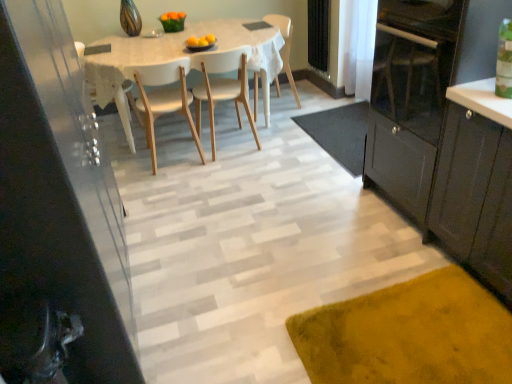
What is the approximate height of velvety yellow rug at lower right, positioned as the second doormat in back-to-front order?

velvety yellow rug at lower right, positioned as the second doormat in back-to-front order, is 1.71 inches in height.

This screenshot has height=384, width=512. Describe the element at coordinates (340, 133) in the screenshot. I see `black rubber doormat at center, which appears as the second doormat when ordered from the bottom` at that location.

The height and width of the screenshot is (384, 512). Describe the element at coordinates (162, 98) in the screenshot. I see `white matte chair at center, placed as the first chair when sorted from left to right` at that location.

Describe the element at coordinates (182, 56) in the screenshot. I see `white wood table at center` at that location.

This screenshot has width=512, height=384. I want to click on matte black cabinet at left, marked as the second cabinetry in a right-to-left arrangement, so click(56, 215).

Which object is further away from the camera, white wood table at center or white matte chair at center, which is the third chair in right-to-left order?

white wood table at center is more distant.

Considering the relative sizes of white wood table at center and white matte chair at center, placed as the first chair when sorted from left to right, in the image provided, is white wood table at center taller than white matte chair at center, placed as the first chair when sorted from left to right,?

In fact, white wood table at center may be shorter than white matte chair at center, placed as the first chair when sorted from left to right.

Which of these two, white wood table at center or white matte chair at center, placed as the first chair when sorted from left to right, is bigger?

With larger size is white wood table at center.

Does point (39, 135) lie in front of point (85, 69)?

Yes, it is.

Which of these two, matte black cabinet at left, which is the first cabinetry in left-to-right order, or white wood table at center, is bigger?

With larger size is white wood table at center.

Is matte black cabinet at left, which is the first cabinetry in left-to-right order, touching white wood table at center?

No.

Does matte black cabinet at left, which is the first cabinetry in left-to-right order, contain white wood table at center?

No, white wood table at center is not a part of matte black cabinet at left, which is the first cabinetry in left-to-right order.

Which object is wider, white sheer curtain at upper right or white matte chair at center, which is the third chair in right-to-left order?

white matte chair at center, which is the third chair in right-to-left order, is wider.

Does white sheer curtain at upper right touch white matte chair at center, placed as the first chair when sorted from left to right?

No, white sheer curtain at upper right is not next to white matte chair at center, placed as the first chair when sorted from left to right.

Between white sheer curtain at upper right and white matte chair at center, placed as the first chair when sorted from left to right, which one appears on the left side from the viewer's perspective?

Positioned to the left is white matte chair at center, placed as the first chair when sorted from left to right.

From the white sheer curtain at upper right, count the 3rd chair to the left and point to it. Please provide its 2D coordinates.

[(162, 98)]

Would you say white matte chair at center, placed as the first chair when sorted from left to right, is outside dark gray wood cabinet at right, which ranks as the second cabinetry in left-to-right order?

Yes, white matte chair at center, placed as the first chair when sorted from left to right, is located beyond the bounds of dark gray wood cabinet at right, which ranks as the second cabinetry in left-to-right order.

Based on their sizes in the image, would you say white matte chair at center, placed as the first chair when sorted from left to right, is bigger or smaller than dark gray wood cabinet at right, the 1th cabinetry positioned from the right?

Clearly, white matte chair at center, placed as the first chair when sorted from left to right, is smaller in size than dark gray wood cabinet at right, the 1th cabinetry positioned from the right.

Considering the points (151, 115) and (496, 247), which point is in front, point (151, 115) or point (496, 247)?

The point (496, 247) is more forward.

From the image's perspective, starting from the dark gray wood cabinet at right, which ranks as the second cabinetry in left-to-right order, which chair is the 1st one above? Please provide its 2D coordinates.

[(162, 98)]

Is matte black cabinet at left, which is the first cabinetry in left-to-right order, positioned with its back to black rubber doormat at center, acting as the 1th doormat starting from the top?

No, matte black cabinet at left, which is the first cabinetry in left-to-right order,'s orientation is not away from black rubber doormat at center, acting as the 1th doormat starting from the top.

Is the depth of matte black cabinet at left, which is the first cabinetry in left-to-right order, greater than that of black rubber doormat at center, marked as the first doormat in a back-to-front arrangement?

No, it is not.

Is matte black cabinet at left, marked as the second cabinetry in a right-to-left arrangement, to the left or to the right of black rubber doormat at center, which is the 2th doormat in front-to-back order, in the image?

matte black cabinet at left, marked as the second cabinetry in a right-to-left arrangement, is to the left of black rubber doormat at center, which is the 2th doormat in front-to-back order.

What are the coordinates of `the 2nd doormat below the matte black cabinet at left, which is the first cabinetry in left-to-right order (from a real-world perspective)` in the screenshot? It's located at (340, 133).

Which object is wider, matte black cabinet at left, which is the first cabinetry in left-to-right order, or natural wood chair at center, which is counted as the 2th chair, starting from the right?

matte black cabinet at left, which is the first cabinetry in left-to-right order.

Which is more to the right, matte black cabinet at left, marked as the second cabinetry in a right-to-left arrangement, or natural wood chair at center, which is counted as the 2th chair, starting from the right?

From the viewer's perspective, natural wood chair at center, which is counted as the 2th chair, starting from the right, appears more on the right side.

From a real-world perspective, which chair is the 1st one underneath the matte black cabinet at left, marked as the second cabinetry in a right-to-left arrangement? Please provide its 2D coordinates.

[(222, 87)]

Between matte black cabinet at left, which is the first cabinetry in left-to-right order, and natural wood chair at center, the second chair in the left-to-right sequence, which one has larger size?

matte black cabinet at left, which is the first cabinetry in left-to-right order, is bigger.

Is white sheer curtain at upper right to the left of white wood table at center from the viewer's perspective?

Incorrect, white sheer curtain at upper right is not on the left side of white wood table at center.

Is white sheer curtain at upper right facing towards white wood table at center?

Yes, white sheer curtain at upper right is facing white wood table at center.

Looking at their sizes, would you say white sheer curtain at upper right is wider or thinner than white wood table at center?

Considering their sizes, white sheer curtain at upper right looks slimmer than white wood table at center.

Image resolution: width=512 pixels, height=384 pixels. In order to click on kitchen & dining room table that is on the left side of white sheer curtain at upper right in this screenshot , I will do `click(182, 56)`.

Identify the location of kitchen & dining room table behind the white matte chair at center, placed as the first chair when sorted from left to right. The height and width of the screenshot is (384, 512). (182, 56).

Which cabinetry is the 2nd one when counting from the front of the white wood table at center? Please provide its 2D coordinates.

[(56, 215)]

When comparing their distances from white wood table at center, does velvety yellow rug at lower right, positioned as the second doormat in back-to-front order, or dark gray wood cabinet at right, the 1th cabinetry positioned from the right, seem further?

Among the two, velvety yellow rug at lower right, positioned as the second doormat in back-to-front order, is located further to white wood table at center.

Estimate the real-world distances between objects in this image. Which object is further from white sheer curtain at upper right, matte black cabinet at left, which is the first cabinetry in left-to-right order, or dark gray wood cabinet at right, which ranks as the second cabinetry in left-to-right order?

matte black cabinet at left, which is the first cabinetry in left-to-right order.

When comparing their distances from white matte chair at center, which is the third chair in right-to-left order, does white wood chair at center, positioned as the first chair in right-to-left order, or velvety yellow rug at lower right, which ranks as the 1th doormat in bottom-to-top order, seem further?

velvety yellow rug at lower right, which ranks as the 1th doormat in bottom-to-top order, lies further to white matte chair at center, which is the third chair in right-to-left order, than the other object.

Estimate the real-world distances between objects in this image. Which object is closer to white matte chair at center, which is the third chair in right-to-left order, dark gray wood cabinet at right, which ranks as the second cabinetry in left-to-right order, or matte black cabinet at left, which is the first cabinetry in left-to-right order?

matte black cabinet at left, which is the first cabinetry in left-to-right order, is closer to white matte chair at center, which is the third chair in right-to-left order.

From the image, which object appears to be nearer to white matte chair at center, which is the third chair in right-to-left order, black rubber doormat at center, acting as the 1th doormat starting from the top, or dark gray wood cabinet at right, the 1th cabinetry positioned from the right?

The object closer to white matte chair at center, which is the third chair in right-to-left order, is black rubber doormat at center, acting as the 1th doormat starting from the top.

When comparing their distances from white matte chair at center, which is the third chair in right-to-left order, does dark gray wood cabinet at right, the 1th cabinetry positioned from the right, or velvety yellow rug at lower right, which is the 1th doormat in front-to-back order, seem further?

Among the two, velvety yellow rug at lower right, which is the 1th doormat in front-to-back order, is located further to white matte chair at center, which is the third chair in right-to-left order.

From the image, which object appears to be nearer to white wood table at center, velvety yellow rug at lower right, which is the 1th doormat in front-to-back order, or natural wood chair at center, the second chair in the left-to-right sequence?

natural wood chair at center, the second chair in the left-to-right sequence.

When comparing their distances from white sheer curtain at upper right, does black rubber doormat at center, which appears as the second doormat when ordered from the bottom, or natural wood chair at center, the second chair in the left-to-right sequence, seem further?

natural wood chair at center, the second chair in the left-to-right sequence, is positioned further to the anchor white sheer curtain at upper right.

Identify the location of kitchen & dining room table between matte black cabinet at left, marked as the second cabinetry in a right-to-left arrangement, and dark gray wood cabinet at right, the 1th cabinetry positioned from the right, from left to right. (182, 56).

Where is `curtain between matte black cabinet at left, which is the first cabinetry in left-to-right order, and white wood chair at center, positioned as the first chair in right-to-left order, from front to back`? curtain between matte black cabinet at left, which is the first cabinetry in left-to-right order, and white wood chair at center, positioned as the first chair in right-to-left order, from front to back is located at coordinates (356, 46).

The width and height of the screenshot is (512, 384). I want to click on kitchen & dining room table between matte black cabinet at left, marked as the second cabinetry in a right-to-left arrangement, and white wood chair at center, positioned as the first chair in right-to-left order, in the front-back direction, so click(x=182, y=56).

Where is `kitchen & dining room table positioned between matte black cabinet at left, marked as the second cabinetry in a right-to-left arrangement, and natural wood chair at center, which is counted as the 2th chair, starting from the right, from near to far`? The width and height of the screenshot is (512, 384). kitchen & dining room table positioned between matte black cabinet at left, marked as the second cabinetry in a right-to-left arrangement, and natural wood chair at center, which is counted as the 2th chair, starting from the right, from near to far is located at coordinates (182, 56).